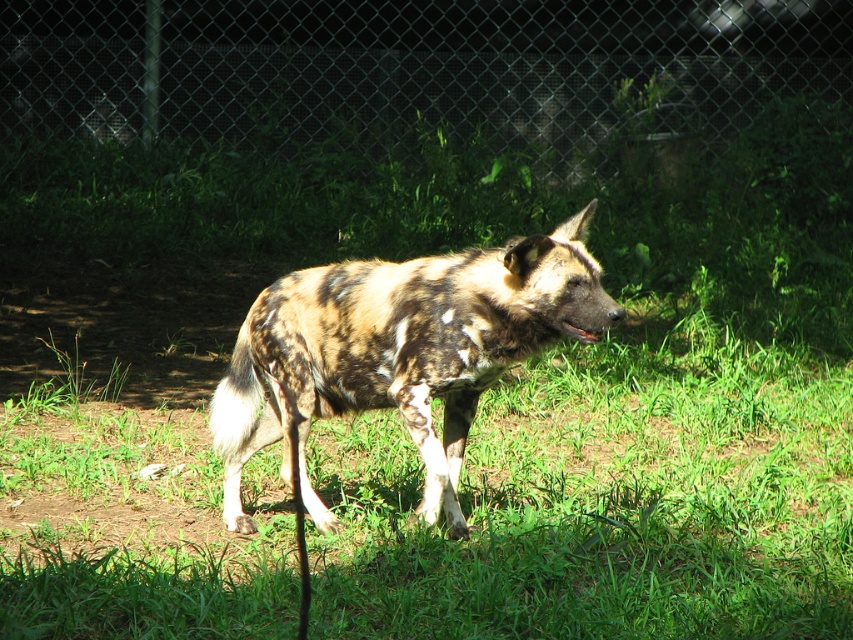
You are a wildlife photographer trying to capture a closeup of the spotted fur dog at center and brown fur mouth at center. If your camera can only focus on one object at a time, which object should you focus on to ensure it fills most of the frame?

The spotted fur dog at center has a larger width than the brown fur mouth at center, so focusing on the spotted fur dog at center will ensure it fills most of the frame.

You are a wildlife photographer trying to capture a closeup of the spotted fur dog at center and the brown fur mouth at center. Which one should you focus on to ensure the subject is in sharp focus?

The spotted fur dog at center is closer to the viewer than the brown fur mouth at center, so focusing on the spotted fur dog at center will ensure it is in sharp focus.